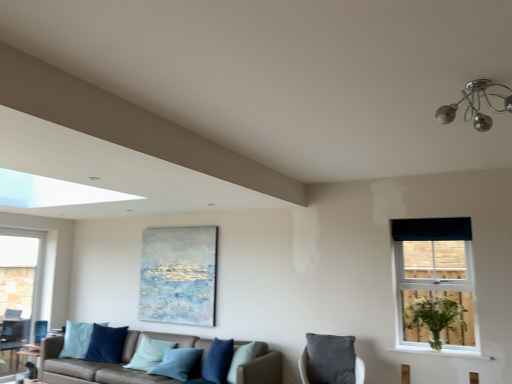
Question: Is black fabric curtain at upper right far away from chrome metallic chandelier at upper right?

Choices:
 (A) no
 (B) yes

Answer: (B)

Question: Is black fabric curtain at upper right at the right side of chrome metallic chandelier at upper right?

Choices:
 (A) no
 (B) yes

Answer: (B)

Question: Does black fabric curtain at upper right have a lesser width compared to chrome metallic chandelier at upper right?

Choices:
 (A) yes
 (B) no

Answer: (A)

Question: Considering the relative sizes of black fabric curtain at upper right and chrome metallic chandelier at upper right in the image provided, is black fabric curtain at upper right bigger than chrome metallic chandelier at upper right?

Choices:
 (A) no
 (B) yes

Answer: (A)

Question: Is black fabric curtain at upper right taller than chrome metallic chandelier at upper right?

Choices:
 (A) yes
 (B) no

Answer: (A)

Question: From their relative heights in the image, would you say textured canvas painting at center is taller or shorter than blue velvet pillow at lower left, the 1th pillow from the back?

Choices:
 (A) tall
 (B) short

Answer: (A)

Question: Based on their positions, is textured canvas painting at center located to the left or right of blue velvet pillow at lower left, positioned as the 1th pillow in left-to-right order?

Choices:
 (A) left
 (B) right

Answer: (B)

Question: Relative to blue velvet pillow at lower left, marked as the 4th pillow in a front-to-back arrangement, is textured canvas painting at center in front or behind?

Choices:
 (A) front
 (B) behind

Answer: (A)

Question: Considering the positions of point (175, 292) and point (75, 322), is point (175, 292) closer or farther from the camera than point (75, 322)?

Choices:
 (A) farther
 (B) closer

Answer: (B)

Question: In terms of size, does green leafy plant at right appear bigger or smaller than leather couch with blue pillows at lower center?

Choices:
 (A) small
 (B) big

Answer: (A)

Question: From the image's perspective, is green leafy plant at right above or below leather couch with blue pillows at lower center?

Choices:
 (A) below
 (B) above

Answer: (B)

Question: Is green leafy plant at right inside the boundaries of leather couch with blue pillows at lower center, or outside?

Choices:
 (A) inside
 (B) outside

Answer: (B)

Question: Does point (451, 294) appear closer or farther from the camera than point (247, 375)?

Choices:
 (A) farther
 (B) closer

Answer: (B)

Question: Looking at the image, does light blue fabric pillow at center, acting as the 3th pillow starting from the right, seem bigger or smaller compared to velvety gray pillow at lower center, placed as the fourth pillow when sorted from back to front?

Choices:
 (A) small
 (B) big

Answer: (B)

Question: From a real-world perspective, is light blue fabric pillow at center, the third pillow positioned from the front, above or below velvety gray pillow at lower center, which is the fourth pillow from left to right?

Choices:
 (A) above
 (B) below

Answer: (B)